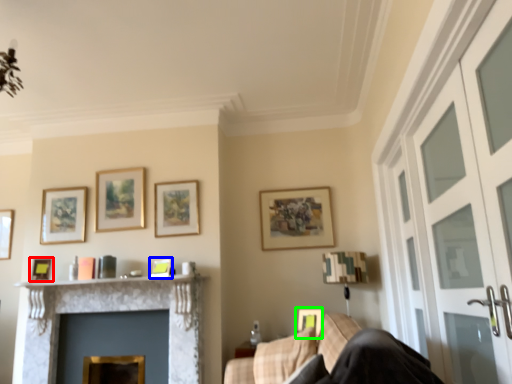
Question: Which is farther away from picture frame (highlighted by a red box)? picture frame (highlighted by a blue box) or picture frame (highlighted by a green box)?

Choices:
 (A) picture frame
 (B) picture frame

Answer: (B)